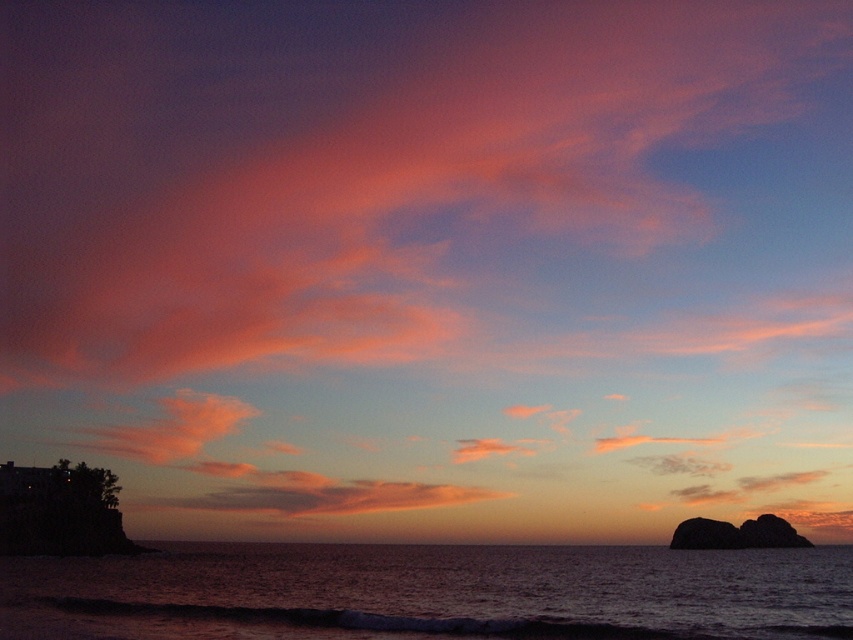
Is dark blue water at lower center bigger than smooth dark rock at lower right?

Indeed, dark blue water at lower center has a larger size compared to smooth dark rock at lower right.

Is dark blue water at lower center to the left of smooth dark rock at lower right from the viewer's perspective?

Correct, you'll find dark blue water at lower center to the left of smooth dark rock at lower right.

Locate an element on the screen. The image size is (853, 640). dark blue water at lower center is located at coordinates (432, 593).